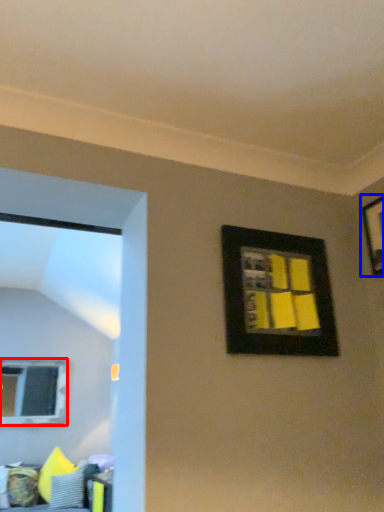
Question: Among these objects, which one is farthest to the camera, window (highlighted by a red box) or picture frame (highlighted by a blue box)?

Choices:
 (A) window
 (B) picture frame

Answer: (A)